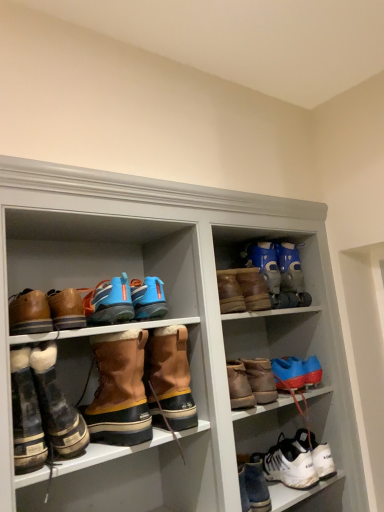
Question: Is the surface of white leather sneakers at lower right, which appears as the thirteenth footwear when viewed from the left, in direct contact with leather boots at left, which ranks as the 1th footwear in left-to-right order?

Choices:
 (A) no
 (B) yes

Answer: (A)

Question: Can you confirm if white leather sneakers at lower right, which is the 1th footwear from right to left, is taller than leather boots at left, positioned as the thirteenth footwear in right-to-left order?

Choices:
 (A) no
 (B) yes

Answer: (B)

Question: Is white leather sneakers at lower right, which is the 1th footwear from right to left, not inside leather boots at left, positioned as the thirteenth footwear in right-to-left order?

Choices:
 (A) no
 (B) yes

Answer: (B)

Question: Would you say leather boots at left, which ranks as the 1th footwear in left-to-right order, is part of white leather sneakers at lower right, which is the 1th footwear from right to left,'s contents?

Choices:
 (A) no
 (B) yes

Answer: (A)

Question: Is white leather sneakers at lower right, which is the 1th footwear from right to left, not close to leather boots at left, which ranks as the 1th footwear in left-to-right order?

Choices:
 (A) yes
 (B) no

Answer: (A)

Question: Is white leather sneakers at lower right, which appears as the thirteenth footwear when viewed from the left, shorter than leather boots at left, positioned as the thirteenth footwear in right-to-left order?

Choices:
 (A) no
 (B) yes

Answer: (A)

Question: From the image's perspective, is white leather sneakers at lower right, which is the 1th footwear from right to left, located beneath brown suede boots at lower left, which is the 10th footwear from right to left?

Choices:
 (A) no
 (B) yes

Answer: (B)

Question: Is white leather sneakers at lower right, which appears as the thirteenth footwear when viewed from the left, oriented towards brown suede boots at lower left, the 4th footwear in the left-to-right sequence?

Choices:
 (A) yes
 (B) no

Answer: (B)

Question: Considering the relative sizes of white leather sneakers at lower right, which appears as the thirteenth footwear when viewed from the left, and brown suede boots at lower left, the 4th footwear in the left-to-right sequence, in the image provided, is white leather sneakers at lower right, which appears as the thirteenth footwear when viewed from the left, bigger than brown suede boots at lower left, the 4th footwear in the left-to-right sequence,?

Choices:
 (A) yes
 (B) no

Answer: (B)

Question: Is white leather sneakers at lower right, which is the 1th footwear from right to left, closer to the viewer compared to brown suede boots at lower left, the 4th footwear in the left-to-right sequence?

Choices:
 (A) yes
 (B) no

Answer: (B)

Question: Is white leather sneakers at lower right, which appears as the thirteenth footwear when viewed from the left, turned away from brown suede boots at lower left, which is the 10th footwear from right to left?

Choices:
 (A) no
 (B) yes

Answer: (A)

Question: Can you confirm if white leather sneakers at lower right, which is the 1th footwear from right to left, is positioned to the left of brown suede boots at lower left, the 4th footwear in the left-to-right sequence?

Choices:
 (A) no
 (B) yes

Answer: (A)

Question: Can you confirm if brown leather boots at left, acting as the third footwear starting from the left, is bigger than blue matte boot at upper right, positioned as the twelfth footwear in left-to-right order?

Choices:
 (A) yes
 (B) no

Answer: (B)